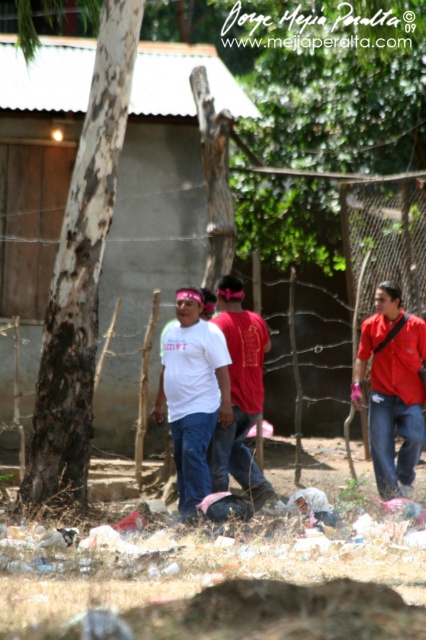
Can you confirm if brown rough bark tree at left is taller than red fabric shirt at center?

Yes.

Does brown rough bark tree at left lie in front of red fabric shirt at center?

That is True.

Who is more forward, (111, 76) or (245, 400)?

Point (111, 76)

Identify the location of brown rough bark tree at left. (81, 273).

Is white matte t-shirt at center below red fabric shirt at center?

Yes, white matte t-shirt at center is below red fabric shirt at center.

Is white matte t-shirt at center to the left of red fabric shirt at center from the viewer's perspective?

Correct, you'll find white matte t-shirt at center to the left of red fabric shirt at center.

Does point (224, 365) come closer to viewer compared to point (249, 404)?

Yes, it is.

The image size is (426, 640). I want to click on white matte t-shirt at center, so click(192, 394).

Which is behind, point (132, 404) or point (371, 428)?

The point (132, 404) is behind.

Between point (29, 68) and point (419, 381), which one is positioned in front?

Point (419, 381) is in front.

The height and width of the screenshot is (640, 426). What do you see at coordinates (157, 209) in the screenshot? I see `concrete wall at center` at bounding box center [157, 209].

Locate an element on the screen. concrete wall at center is located at coordinates (157, 209).